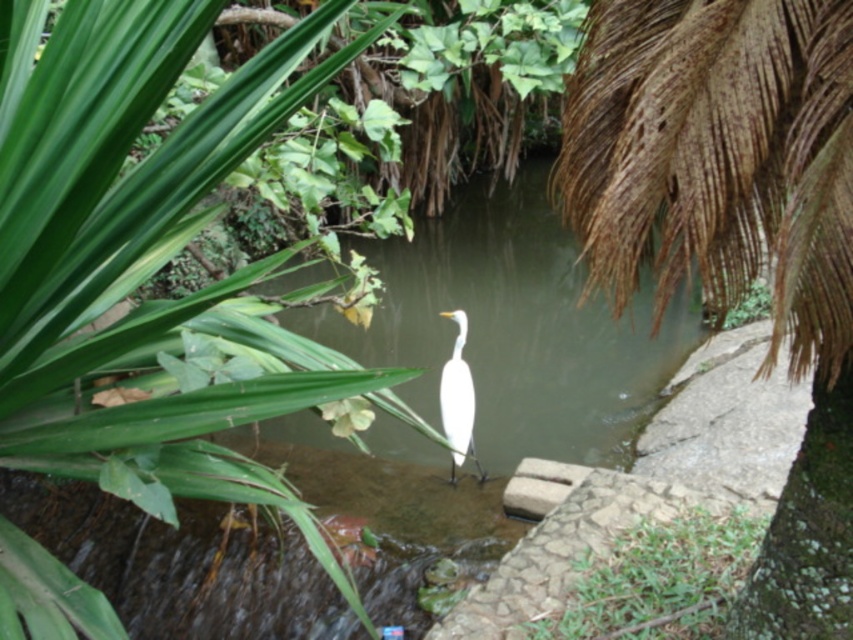
Who is positioned more to the left, green leafy palm tree at center-left or white smooth bird at center?

green leafy palm tree at center-left

Locate an element on the screen. The width and height of the screenshot is (853, 640). green leafy palm tree at center-left is located at coordinates (144, 253).

Does point (32, 397) come closer to viewer compared to point (456, 460)?

Yes.

Where is `green leafy palm tree at center-left`? The width and height of the screenshot is (853, 640). green leafy palm tree at center-left is located at coordinates (144, 253).

Can you confirm if brown/dried palm fronds at upper right is shorter than white smooth bird at center?

In fact, brown/dried palm fronds at upper right may be taller than white smooth bird at center.

Does point (821, 593) come in front of point (465, 432)?

Yes, it is.

Locate an element on the screen. The width and height of the screenshot is (853, 640). brown/dried palm fronds at upper right is located at coordinates (735, 228).

Which of these two, green leafy palm tree at center-left or brown/dried palm fronds at upper right, stands taller?

green leafy palm tree at center-left is taller.

Measure the distance from green leafy palm tree at center-left to brown/dried palm fronds at upper right.

They are 3.76 feet apart.

You are a GUI agent. You are given a task and a screenshot of the screen. Output one action in this format:
    pyautogui.click(x=<x>, y=<y>)
    Task: Click on the green leafy palm tree at center-left
    The image size is (853, 640).
    Given the screenshot: What is the action you would take?
    pyautogui.click(x=144, y=253)